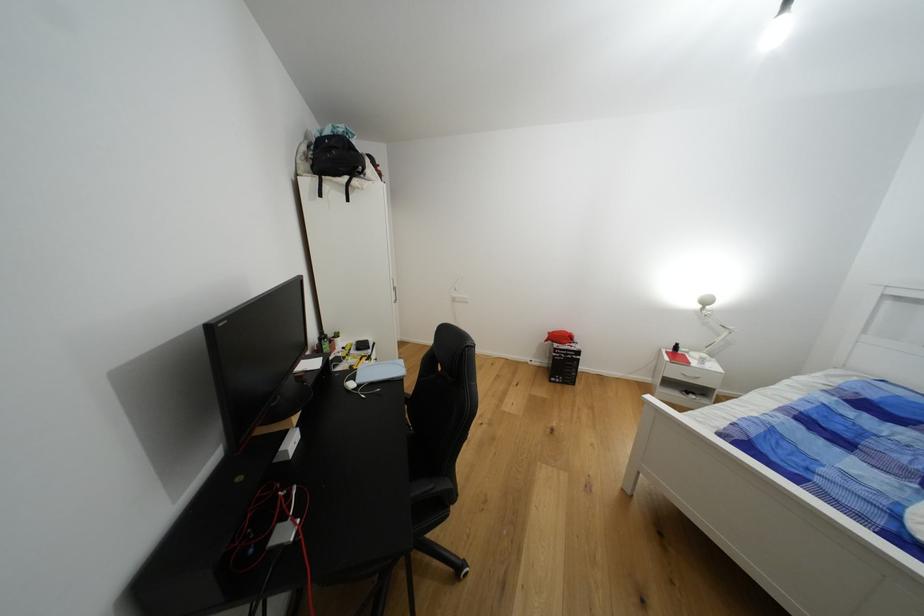
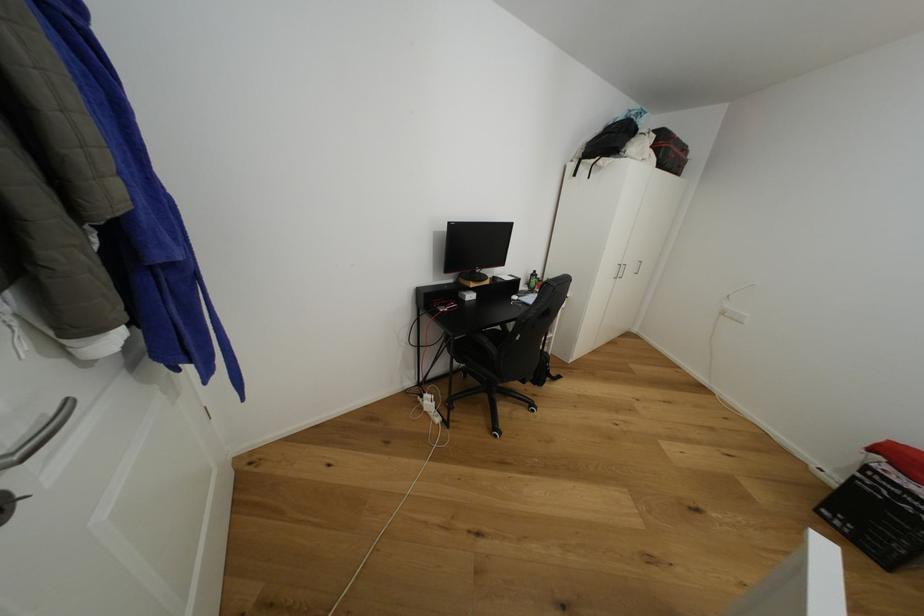
Find the pixel in the second image that matches (x=436, y=488) in the first image.

(491, 342)